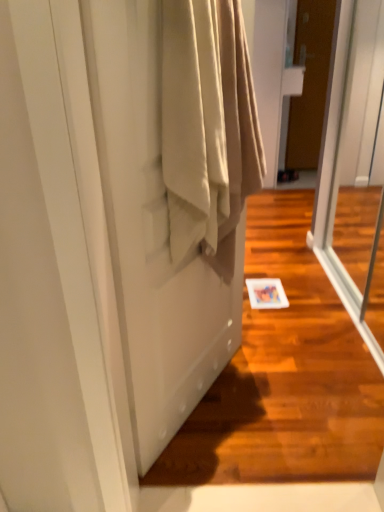
Question: Is transparent glass screen door at right, arranged as the 2th screen door when viewed from the left, surrounded by beige fabric at center?

Choices:
 (A) yes
 (B) no

Answer: (B)

Question: Is beige fabric at center at the right side of transparent glass screen door at right, which is counted as the first screen door, starting from the right?

Choices:
 (A) no
 (B) yes

Answer: (A)

Question: Is beige fabric at center taller than transparent glass screen door at right, which is counted as the first screen door, starting from the right?

Choices:
 (A) yes
 (B) no

Answer: (B)

Question: Considering the relative positions of beige fabric at center and transparent glass screen door at right, which is counted as the first screen door, starting from the right, in the image provided, is beige fabric at center to the left of transparent glass screen door at right, which is counted as the first screen door, starting from the right, from the viewer's perspective?

Choices:
 (A) yes
 (B) no

Answer: (A)

Question: From a real-world perspective, does beige fabric at center sit lower than transparent glass screen door at right, which is counted as the first screen door, starting from the right?

Choices:
 (A) yes
 (B) no

Answer: (B)

Question: From the image's perspective, does beige fabric at center appear higher than transparent glass screen door at right, which is counted as the first screen door, starting from the right?

Choices:
 (A) no
 (B) yes

Answer: (A)

Question: Is beige fabric at center in contact with brown matte door at upper right?

Choices:
 (A) no
 (B) yes

Answer: (A)

Question: From the image's perspective, is beige fabric at center located above brown matte door at upper right?

Choices:
 (A) yes
 (B) no

Answer: (B)

Question: Is beige fabric at center in front of brown matte door at upper right?

Choices:
 (A) no
 (B) yes

Answer: (B)

Question: Can you confirm if beige fabric at center is smaller than brown matte door at upper right?

Choices:
 (A) no
 (B) yes

Answer: (B)

Question: Is beige fabric at center at the left side of brown matte door at upper right?

Choices:
 (A) yes
 (B) no

Answer: (A)

Question: Does beige fabric at center have a greater height compared to brown matte door at upper right?

Choices:
 (A) yes
 (B) no

Answer: (B)

Question: Is transparent glass screen door at right, arranged as the 2th screen door when viewed from the left, in front of satin beige curtain at lower left, the 1th screen door from the left?

Choices:
 (A) yes
 (B) no

Answer: (B)